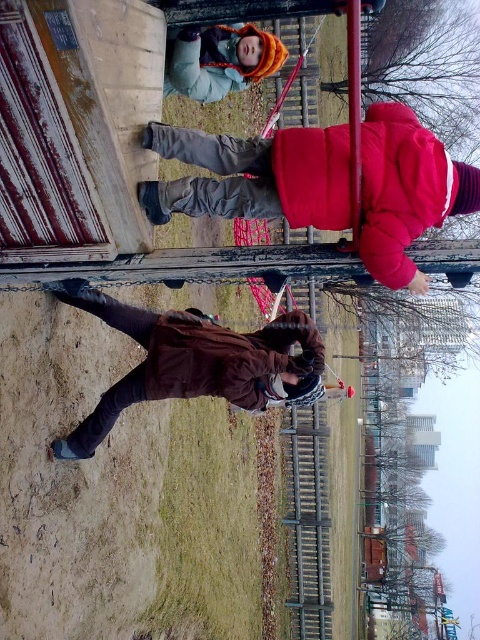
Does brown matte jacket at center lie in front of metallic chain at upper center?

That is False.

Is point (151, 353) farther from camera compared to point (347, 4)?

Yes, it is behind point (347, 4).

Locate an element on the screen. This screenshot has width=480, height=640. brown matte jacket at center is located at coordinates (228, 358).

This screenshot has height=640, width=480. Identify the location of brown matte jacket at lower center. (188, 360).

Is brown matte jacket at lower center to the right of brown matte jacket at center from the viewer's perspective?

Incorrect, brown matte jacket at lower center is not on the right side of brown matte jacket at center.

Who is more distant from viewer, (143, 333) or (149, 356)?

The point (143, 333) is behind.

The image size is (480, 640). What are the coordinates of `brown matte jacket at lower center` in the screenshot? It's located at (188, 360).

From the picture: Who is positioned more to the left, brown matte jacket at lower center or orange knit hat at upper center?

From the viewer's perspective, brown matte jacket at lower center appears more on the left side.

Is point (135, 317) positioned after point (236, 72)?

No.

Does point (263, 408) come behind point (190, 77)?

No, (263, 408) is in front of (190, 77).

Locate an element on the screen. The image size is (480, 640). brown matte jacket at lower center is located at coordinates (188, 360).